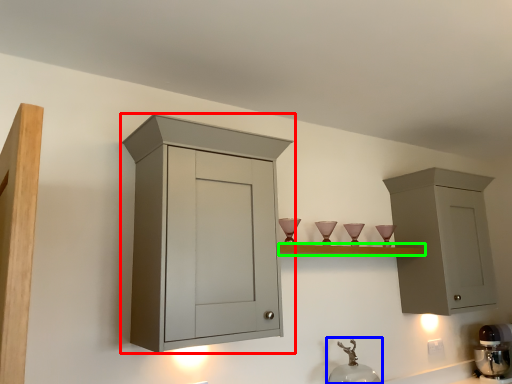
Question: Which object is positioned farthest from cabinetry (highlighted by a red box)? Select from faucet (highlighted by a blue box) and shelf (highlighted by a green box).

Choices:
 (A) faucet
 (B) shelf

Answer: (A)